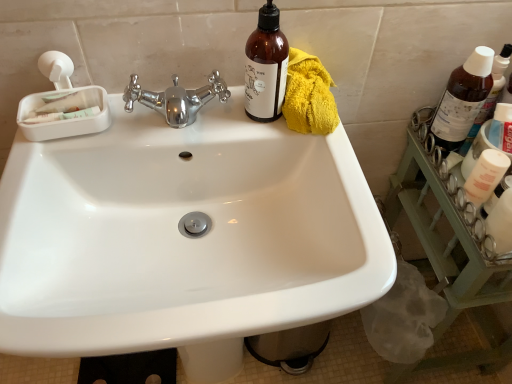
Question: From a real-world perspective, is white glossy sink at center positioned above or below yellow fluffy towel at upper right?

Choices:
 (A) below
 (B) above

Answer: (A)

Question: Is white glossy sink at center taller or shorter than yellow fluffy towel at upper right?

Choices:
 (A) short
 (B) tall

Answer: (B)

Question: Based on their relative distances, which object is farther from the brown glass bottle at upper right, marked as the third bottle in a left-to-right arrangement?

Choices:
 (A) brown glass bottle at upper right, acting as the 3th bottle starting from the right
 (B) brown glass bottle at upper right, marked as the 2th bottle in a right-to-left arrangement
 (C) white glossy sink at center
 (D) yellow fluffy towel at upper right

Answer: (C)

Question: Which object is the farthest from the white glossy sink at center?

Choices:
 (A) brown glass bottle at upper right, placed as the first bottle when sorted from right to left
 (B) brown glass bottle at upper right, marked as the 2th bottle in a right-to-left arrangement
 (C) yellow fluffy towel at upper right
 (D) brown glass bottle at upper right, which is the 1th bottle in left-to-right order

Answer: (A)